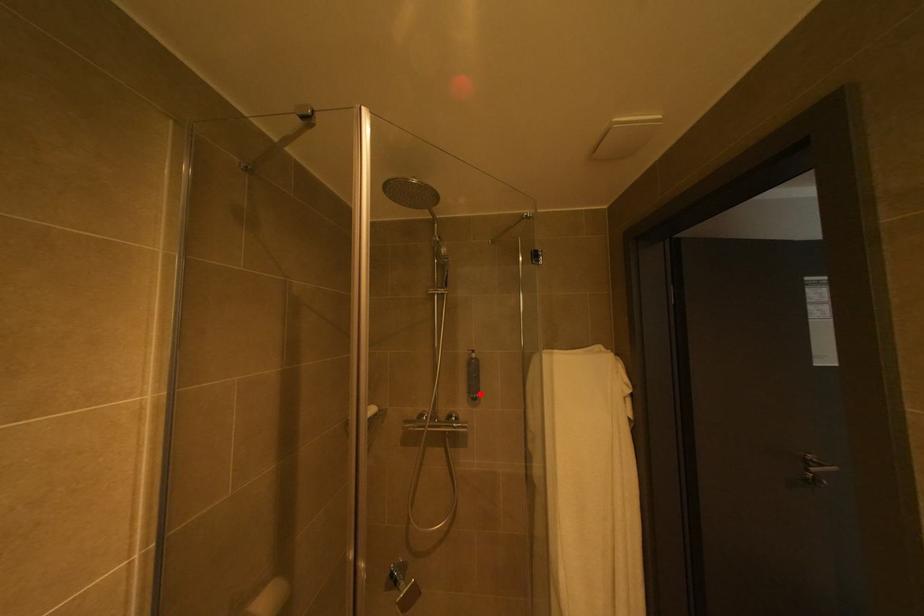
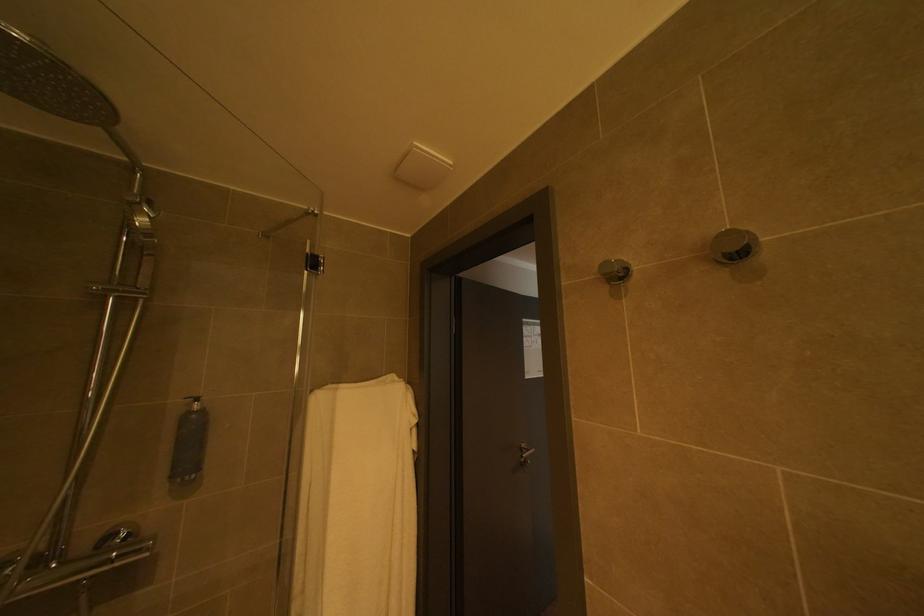
Find the pixel in the second image that matches the highlighted location in the first image.

(184, 477)